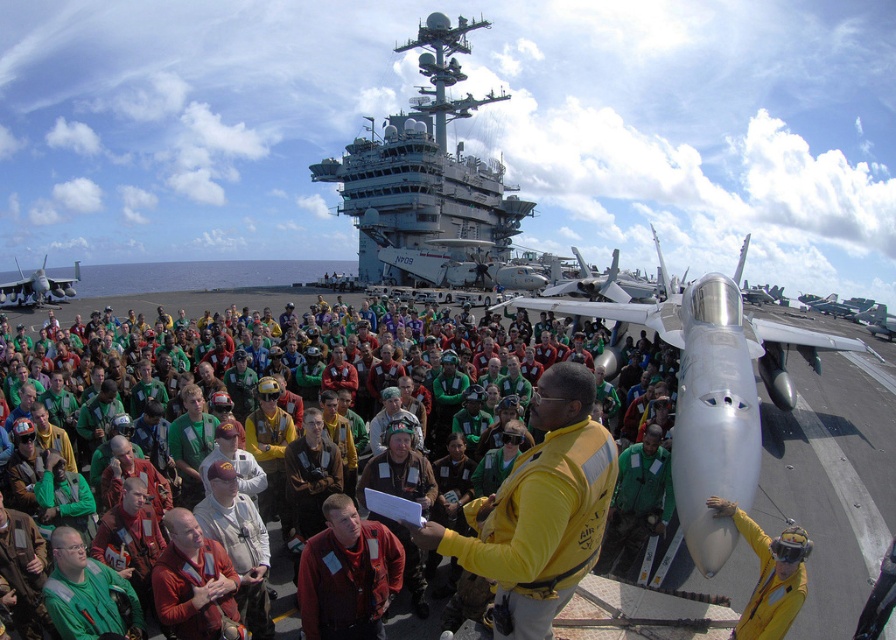
Question: Which object is the closest to the white fabric shirt at center?

Choices:
 (A) silver metallic jet at left
 (B) yellow fabric sailor at center
 (C) red fabric jacket at center

Answer: (C)

Question: Which of the following is the farthest from the observer?

Choices:
 (A) brown leather jacket at center
 (B) white fabric shirt at center
 (C) green fabric crowd at center

Answer: (C)

Question: Can you confirm if silver metallic jet at center is positioned below red fabric jacket at center?

Choices:
 (A) yes
 (B) no

Answer: (B)

Question: Among these objects, which one is nearest to the camera?

Choices:
 (A) white glossy aircraft carrier at upper center
 (B) red fabric jacket at center

Answer: (B)

Question: Is red fabric jacket at center further to the viewer compared to white fabric shirt at center?

Choices:
 (A) no
 (B) yes

Answer: (A)

Question: Is green fabric crowd at center closer to camera compared to brown leather jacket at center?

Choices:
 (A) no
 (B) yes

Answer: (A)